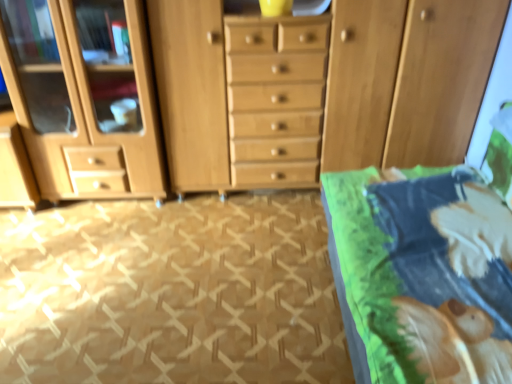
Question: Should I look upward or downward to see wooden dresser at center?

Choices:
 (A) up
 (B) down

Answer: (A)

Question: Is beige carpet at lower left facing away from wooden dresser at center?

Choices:
 (A) no
 (B) yes

Answer: (A)

Question: Can you confirm if beige carpet at lower left is shorter than wooden dresser at center?

Choices:
 (A) no
 (B) yes

Answer: (B)

Question: Is wooden dresser at center inside beige carpet at lower left?

Choices:
 (A) yes
 (B) no

Answer: (B)

Question: Does beige carpet at lower left touch wooden dresser at center?

Choices:
 (A) yes
 (B) no

Answer: (B)

Question: From the image's perspective, would you say beige carpet at lower left is positioned over wooden dresser at center?

Choices:
 (A) no
 (B) yes

Answer: (A)

Question: From a real-world perspective, is beige carpet at lower left physically above wooden dresser at center?

Choices:
 (A) no
 (B) yes

Answer: (A)

Question: Considering the relative positions of wooden dresser at center and beige carpet at lower left in the image provided, is wooden dresser at center in front of beige carpet at lower left?

Choices:
 (A) yes
 (B) no

Answer: (B)

Question: From the image's perspective, would you say wooden dresser at center is shown under beige carpet at lower left?

Choices:
 (A) no
 (B) yes

Answer: (A)

Question: Is wooden dresser at center at the left side of beige carpet at lower left?

Choices:
 (A) no
 (B) yes

Answer: (A)

Question: From a real-world perspective, does wooden dresser at center stand above beige carpet at lower left?

Choices:
 (A) no
 (B) yes

Answer: (B)

Question: Is wooden dresser at center taller than beige carpet at lower left?

Choices:
 (A) yes
 (B) no

Answer: (A)

Question: Is wooden dresser at center smaller than beige carpet at lower left?

Choices:
 (A) no
 (B) yes

Answer: (A)

Question: Does green fabric bed at right have a lesser width compared to wooden dresser at center?

Choices:
 (A) yes
 (B) no

Answer: (B)